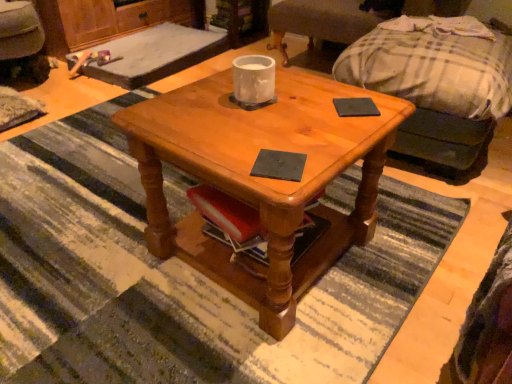
The image size is (512, 384). I want to click on empty space that is in between black matte pad at center, the 2th pad positioned from the left, and black matte coaster at center, the second pad positioned from the right, so click(x=325, y=134).